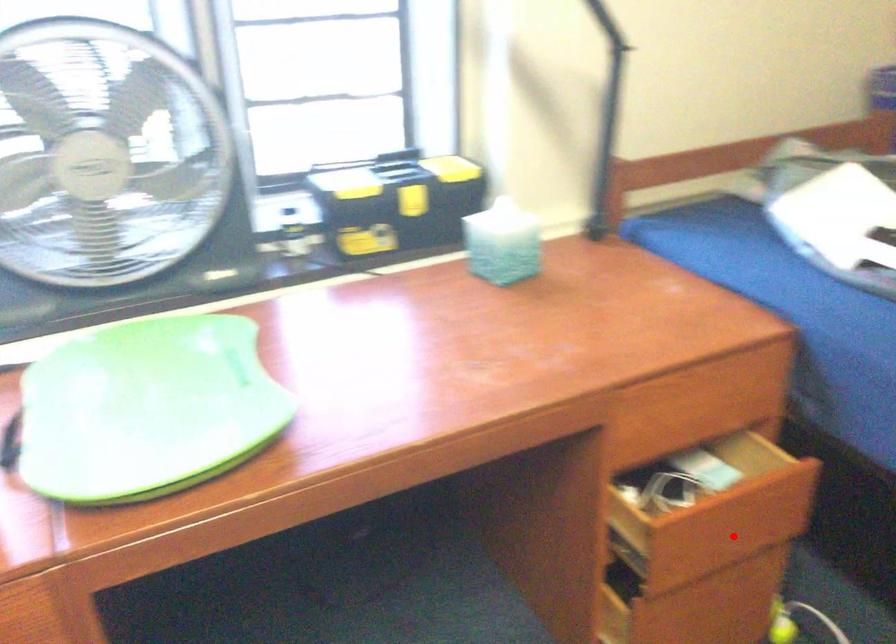
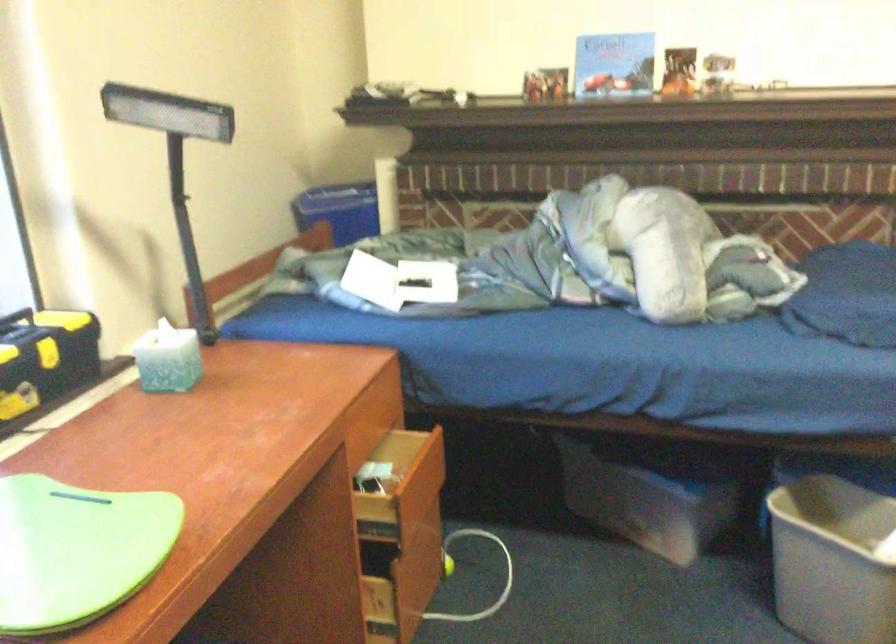
Question: I am providing you with two images of the same scene from different viewpoints. A red point is marked on the first image. At the location where the point appears in image 1, is it still visible in image 2?

Choices:
 (A) Yes
 (B) No

Answer: (A)